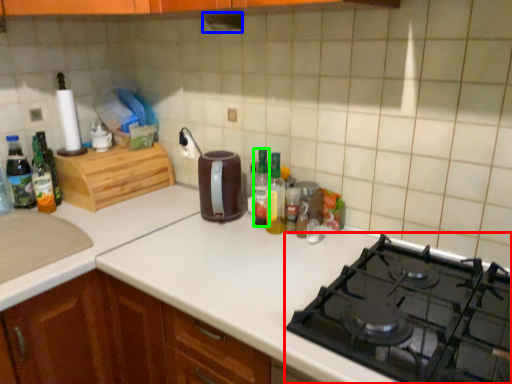
Question: Estimate the real-world distances between objects in this image. Which object is farther from gas stove (highlighted by a red box), exhaust hood (highlighted by a blue box) or bottle (highlighted by a green box)?

Choices:
 (A) exhaust hood
 (B) bottle

Answer: (A)